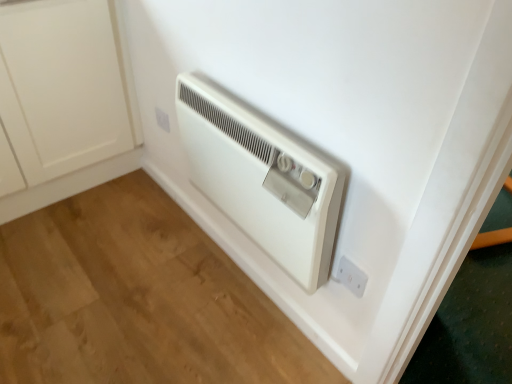
Question: From a real-world perspective, is white plastic electric outlet at lower right, positioned as the first electric outlet in right-to-left order, physically below white plastic electric outlet at lower center, arranged as the 1th electric outlet when viewed from the back?

Choices:
 (A) yes
 (B) no

Answer: (A)

Question: Does white plastic electric outlet at lower right, positioned as the 2th electric outlet in back-to-front order, have a lesser height compared to white plastic electric outlet at lower center, which is the 2th electric outlet from front to back?

Choices:
 (A) yes
 (B) no

Answer: (B)

Question: Can you confirm if white plastic electric outlet at lower right, which is the 2th electric outlet in top-to-bottom order, is thinner than white plastic electric outlet at lower center, which is the 2th electric outlet from front to back?

Choices:
 (A) yes
 (B) no

Answer: (A)

Question: Is white plastic electric outlet at lower right, which is the 2th electric outlet in top-to-bottom order, positioned far away from white plastic electric outlet at lower center, acting as the 1th electric outlet starting from the left?

Choices:
 (A) no
 (B) yes

Answer: (A)

Question: Is white plastic electric outlet at lower center, arranged as the second electric outlet when viewed from the right, surrounded by white plastic electric outlet at lower right, which is the 2th electric outlet in top-to-bottom order?

Choices:
 (A) no
 (B) yes

Answer: (A)

Question: Is white matte cabinet at lower left situated inside white plastic heater at center or outside?

Choices:
 (A) outside
 (B) inside

Answer: (A)

Question: Based on their sizes in the image, would you say white matte cabinet at lower left is bigger or smaller than white plastic heater at center?

Choices:
 (A) small
 (B) big

Answer: (B)

Question: From a real-world perspective, relative to white plastic heater at center, is white matte cabinet at lower left vertically above or below?

Choices:
 (A) above
 (B) below

Answer: (B)

Question: Considering the positions of point (61, 130) and point (202, 183), is point (61, 130) closer or farther from the camera than point (202, 183)?

Choices:
 (A) closer
 (B) farther

Answer: (B)

Question: From the image's perspective, relative to white plastic electric outlet at lower center, which is the 2th electric outlet from front to back, is white plastic electric outlet at lower right, which is the second electric outlet in left-to-right order, above or below?

Choices:
 (A) above
 (B) below

Answer: (B)

Question: Is white plastic electric outlet at lower right, positioned as the 2th electric outlet in back-to-front order, bigger or smaller than white plastic electric outlet at lower center, which ranks as the second electric outlet in bottom-to-top order?

Choices:
 (A) big
 (B) small

Answer: (B)

Question: Does point (359, 276) appear closer or farther from the camera than point (160, 125)?

Choices:
 (A) farther
 (B) closer

Answer: (B)

Question: Considering the positions of white plastic electric outlet at lower right, the first electric outlet from the bottom, and white plastic electric outlet at lower center, arranged as the 1th electric outlet when viewed from the back, in the image, is white plastic electric outlet at lower right, the first electric outlet from the bottom, wider or thinner than white plastic electric outlet at lower center, arranged as the 1th electric outlet when viewed from the back,?

Choices:
 (A) wide
 (B) thin

Answer: (B)

Question: Is white plastic electric outlet at lower center, arranged as the 1th electric outlet when viewed from the back, taller or shorter than white plastic heater at center?

Choices:
 (A) tall
 (B) short

Answer: (B)

Question: From the image's perspective, relative to white plastic heater at center, is white plastic electric outlet at lower center, placed as the first electric outlet when sorted from top to bottom, above or below?

Choices:
 (A) below
 (B) above

Answer: (B)